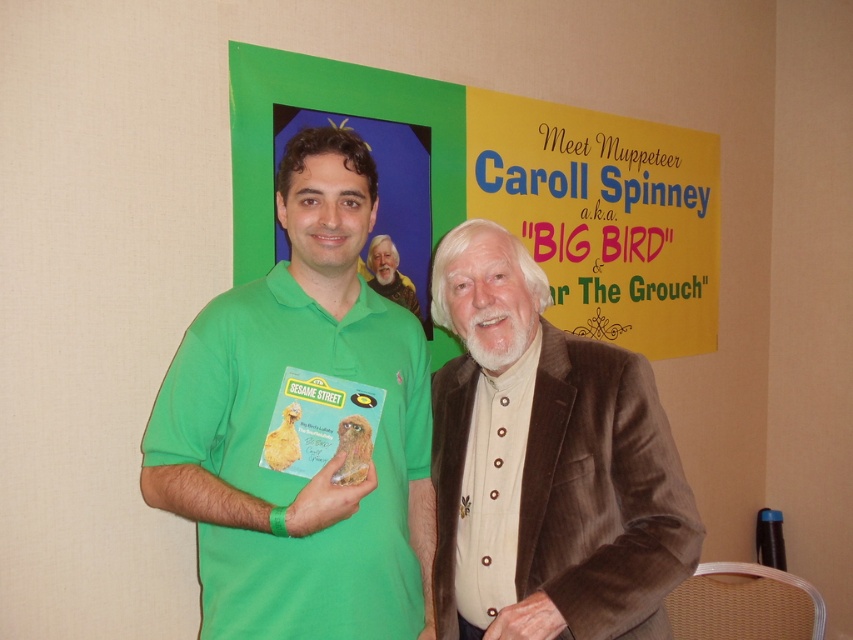
Question: Does brown corduroy suit at center have a larger size compared to beige textured suit at center?

Choices:
 (A) yes
 (B) no

Answer: (A)

Question: Does green matte poster at upper center have a smaller size compared to beige textured suit at center?

Choices:
 (A) no
 (B) yes

Answer: (A)

Question: Which point is farther to the camera?

Choices:
 (A) (663, 577)
 (B) (422, 177)
 (C) (315, 522)

Answer: (B)

Question: Can you confirm if green cotton shirt at center is positioned below green matte poster at upper center?

Choices:
 (A) yes
 (B) no

Answer: (A)

Question: Which point appears closest to the camera in this image?

Choices:
 (A) (235, 486)
 (B) (666, 586)
 (C) (408, 157)
 (D) (379, 275)

Answer: (B)

Question: Based on their relative distances, which object is farther from the green cotton shirt at center?

Choices:
 (A) brown corduroy suit at center
 (B) beige textured suit at center
 (C) green matte poster at upper center

Answer: (C)